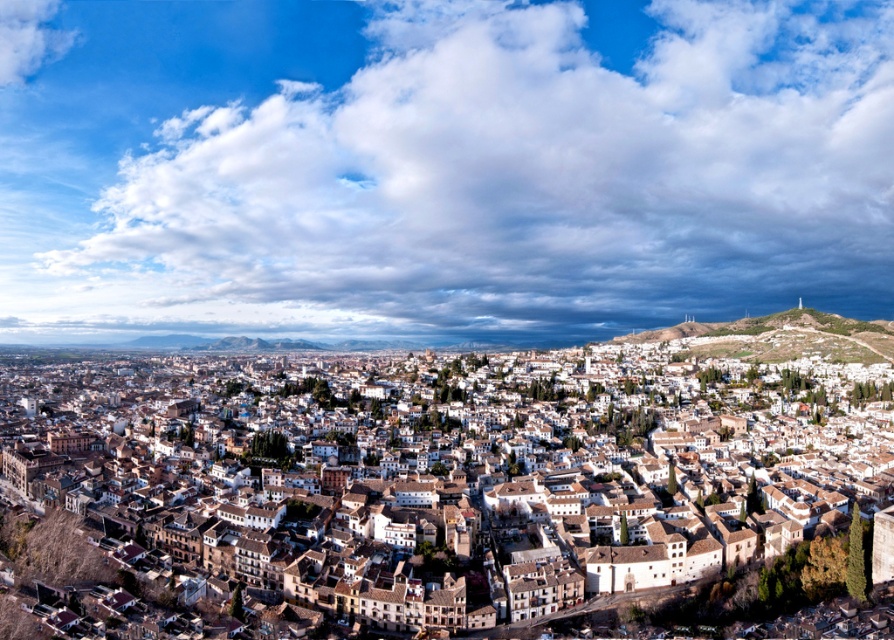
You are an architect analyzing the urban layout of the city in the image. You notice the white textured buildings at center and the white fluffy cloud at upper left. Which of these two objects is located higher in the sky?

The white fluffy cloud at upper left is higher in the sky than the white textured buildings at center.

You are a city planner assessing the urban layout. You need to determine if the cloudy sky at upper center is within a 1000 feet safety zone from the white textured buildings at center for drone operations. Can it be included in the zone?

The cloudy sky at upper center is 939.83 feet from the white textured buildings at center, so yes, it is within the 1000 feet safety zone and can be included.